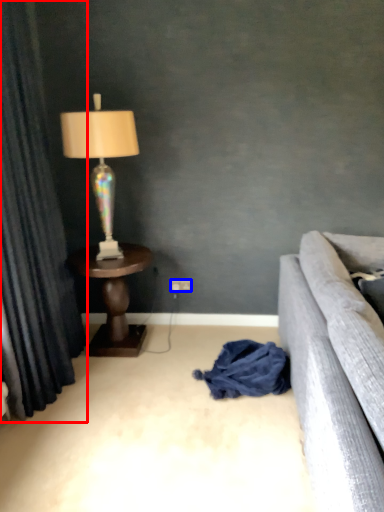
Question: Which point is closer to the camera, curtain (highlighted by a red box) or power outlet (highlighted by a blue box)?

Choices:
 (A) curtain
 (B) power outlet

Answer: (A)